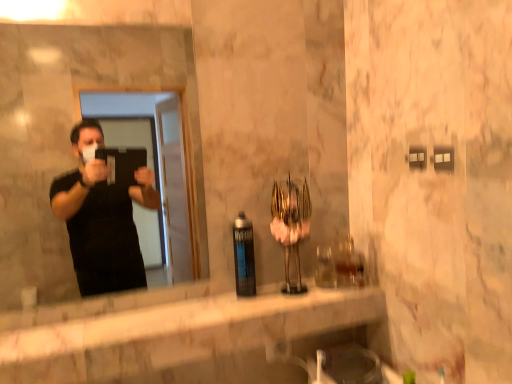
Identify the location of vacant space to the left of matte black spray can at center. This screenshot has width=512, height=384. (190, 312).